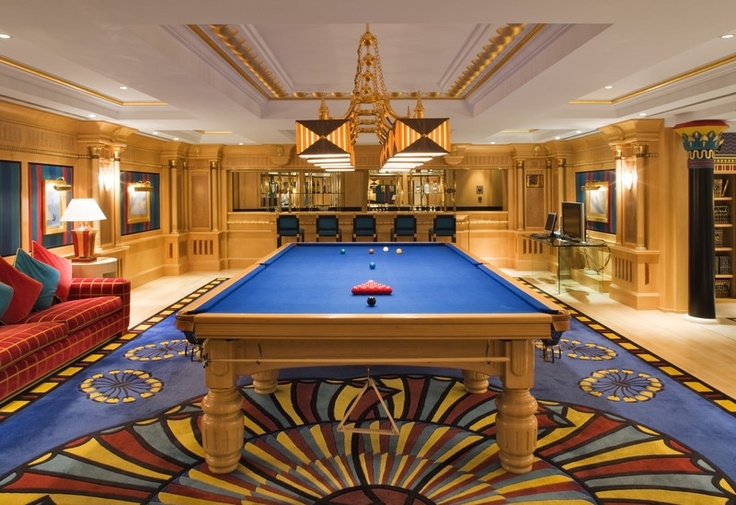
Identify the location of column. (634, 207), (706, 165), (561, 173), (520, 180), (216, 183), (180, 184), (173, 184), (116, 177), (95, 172), (79, 470).